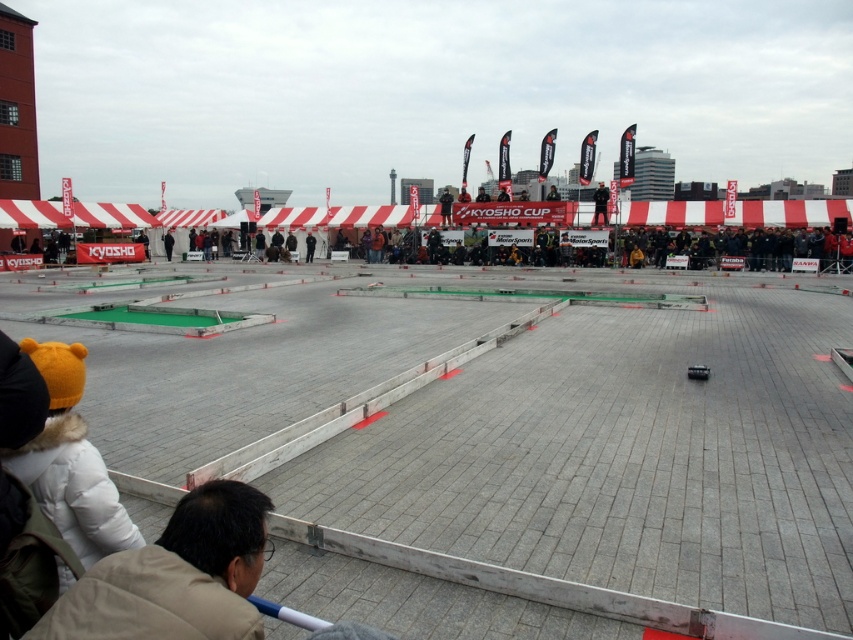
Question: Is beige fabric jacket at lower left wider than white fur-lined coat at lower left?

Choices:
 (A) no
 (B) yes

Answer: (B)

Question: Can you confirm if beige fabric jacket at lower left is positioned to the right of dark gray jacket at center?

Choices:
 (A) yes
 (B) no

Answer: (A)

Question: Which object appears closest to the camera in this image?

Choices:
 (A) white fur-lined coat at lower left
 (B) beige fabric jacket at lower left

Answer: (B)

Question: Which of the following is the closest to the observer?

Choices:
 (A) (28, 481)
 (B) (126, 632)

Answer: (B)

Question: Which of the following is the farthest from the observer?

Choices:
 (A) (38, 355)
 (B) (408, 346)

Answer: (B)

Question: Does concrete gray race track at center appear on the left side of beige fabric jacket at lower left?

Choices:
 (A) no
 (B) yes

Answer: (A)